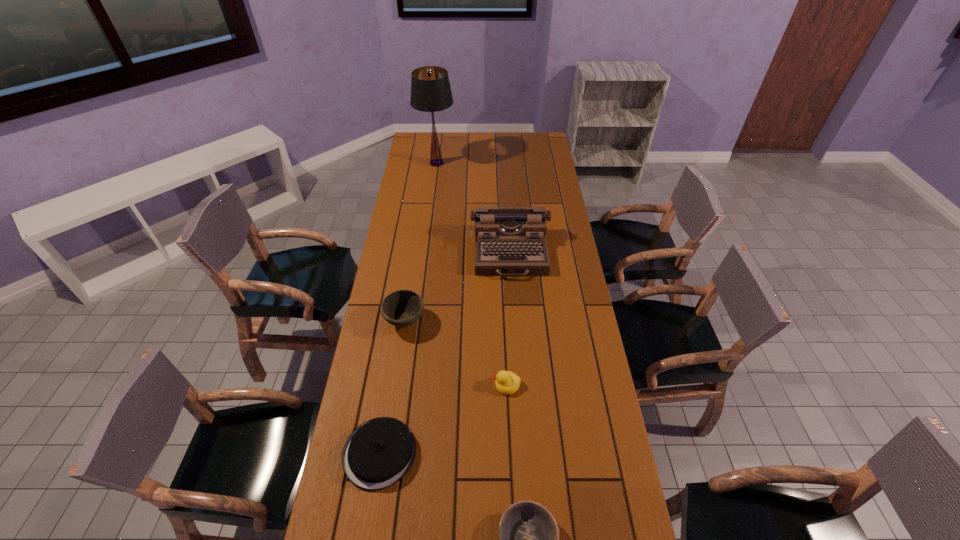
You are a GUI agent. You are given a task and a screenshot of the screen. Output one action in this format:
    pyautogui.click(x=<x>, y=<y>)
    Task: Click on the tallest object
    This screenshot has width=960, height=540.
    Given the screenshot: What is the action you would take?
    pyautogui.click(x=430, y=88)

Identify the location of lampshade. (430, 88).

In order to click on typewriter in this screenshot , I will do `click(509, 241)`.

At what (x,y) coordinates should I click in order to perform the action: click on the fifth shortest object. Please return your answer as a coordinate pair (x, y). Looking at the image, I should click on (509, 241).

Where is `the taller bowl`? the taller bowl is located at coordinates (402, 308).

Locate an element on the screen. This screenshot has width=960, height=540. the left bowl is located at coordinates (402, 308).

Where is `the fourth farthest object`? This screenshot has height=540, width=960. the fourth farthest object is located at coordinates (507, 382).

Image resolution: width=960 pixels, height=540 pixels. Find the location of `the fifth farthest object`. the fifth farthest object is located at coordinates (378, 453).

Where is `vacant region located on the front-facing side of the lampshade`? This screenshot has width=960, height=540. vacant region located on the front-facing side of the lampshade is located at coordinates (471, 163).

The height and width of the screenshot is (540, 960). Find the location of `vacant space located on the keyboard of the fifth nearest object`. vacant space located on the keyboard of the fifth nearest object is located at coordinates (517, 360).